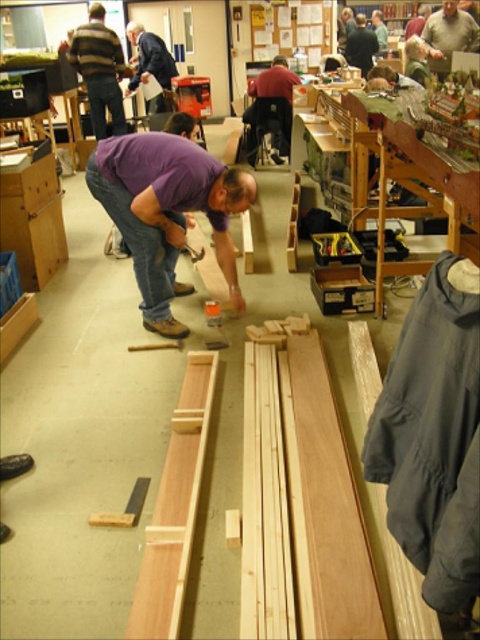
Is blue shirt at center wider than dark blue shirt at center?

Correct, the width of blue shirt at center exceeds that of dark blue shirt at center.

Who is positioned more to the right, blue shirt at center or dark blue shirt at center?

dark blue shirt at center

Is point (156, 38) closer to viewer compared to point (346, 48)?

That is True.

Find the location of `blue shirt at center`. blue shirt at center is located at coordinates coord(151,65).

What do you see at coordinates (167, 211) in the screenshot? I see `purple matte shirt at center` at bounding box center [167, 211].

Is purple matte shirt at center to the right of dark red shirt at center from the viewer's perspective?

In fact, purple matte shirt at center is to the left of dark red shirt at center.

Where is `purple matte shirt at center`? The height and width of the screenshot is (640, 480). purple matte shirt at center is located at coordinates (x=167, y=211).

Between light brown wood at upper right and dark blue shirt at center, which one has less height?

light brown wood at upper right is shorter.

Which is in front, point (431, 19) or point (360, 17)?

Point (431, 19) is more forward.

The image size is (480, 640). I want to click on light brown wood at upper right, so pyautogui.click(x=447, y=35).